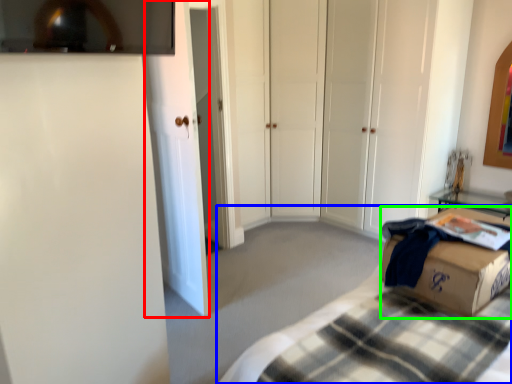
Question: Considering the real-world distances, which object is farthest from glass door (highlighted by a red box)? bed (highlighted by a blue box) or box (highlighted by a green box)?

Choices:
 (A) bed
 (B) box

Answer: (B)